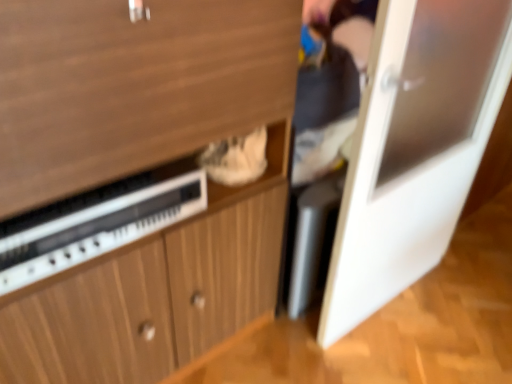
Question: Is white glossy door at right to the left of white plastic radio at lower left from the viewer's perspective?

Choices:
 (A) no
 (B) yes

Answer: (A)

Question: Can you confirm if white glossy door at right is smaller than white plastic radio at lower left?

Choices:
 (A) yes
 (B) no

Answer: (B)

Question: Is white glossy door at right facing towards white plastic radio at lower left?

Choices:
 (A) yes
 (B) no

Answer: (B)

Question: Does white glossy door at right have a larger size compared to white plastic radio at lower left?

Choices:
 (A) yes
 (B) no

Answer: (A)

Question: Is white plastic radio at lower left at the back of white glossy door at right?

Choices:
 (A) yes
 (B) no

Answer: (B)

Question: From the image's perspective, is white glossy door at right below white plastic radio at lower left?

Choices:
 (A) no
 (B) yes

Answer: (A)

Question: Is wooden cabinet at center looking in the opposite direction of white plastic radio at lower left?

Choices:
 (A) no
 (B) yes

Answer: (B)

Question: Considering the relative sizes of wooden cabinet at center and white plastic radio at lower left in the image provided, is wooden cabinet at center thinner than white plastic radio at lower left?

Choices:
 (A) no
 (B) yes

Answer: (A)

Question: Can you confirm if wooden cabinet at center is smaller than white plastic radio at lower left?

Choices:
 (A) no
 (B) yes

Answer: (A)

Question: From the image's perspective, does wooden cabinet at center appear lower than white plastic radio at lower left?

Choices:
 (A) yes
 (B) no

Answer: (A)

Question: From a real-world perspective, does wooden cabinet at center sit lower than white plastic radio at lower left?

Choices:
 (A) no
 (B) yes

Answer: (B)

Question: Does wooden cabinet at center appear on the right side of white plastic radio at lower left?

Choices:
 (A) no
 (B) yes

Answer: (B)

Question: Is wooden cabinet at center positioned behind white glossy door at right?

Choices:
 (A) no
 (B) yes

Answer: (A)